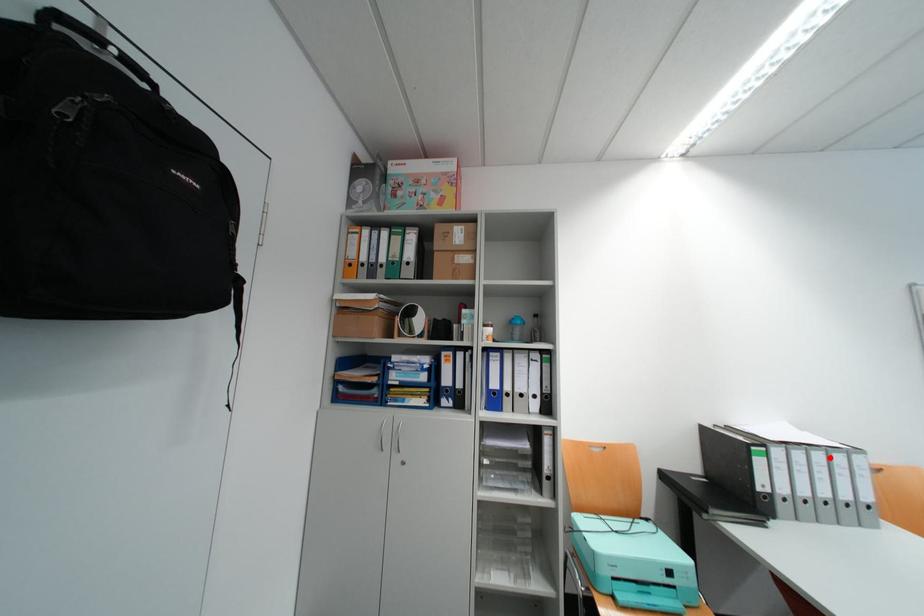
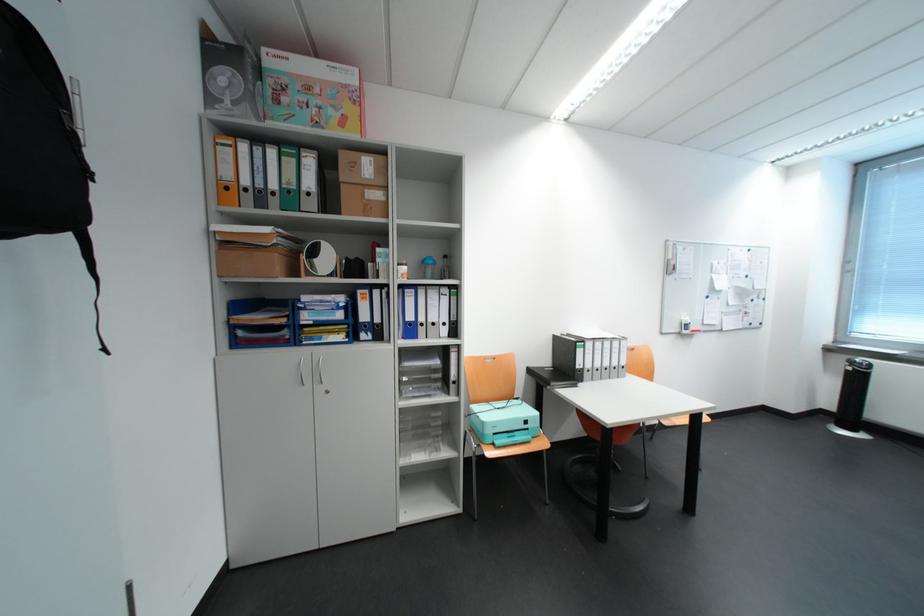
Question: I am providing you with two images of the same scene from different viewpoints. In image1, a red point is highlighted. Considering the same 3D point in image2, which of the following is correct?

Choices:
 (A) It is closer
 (B) It is farther

Answer: (B)